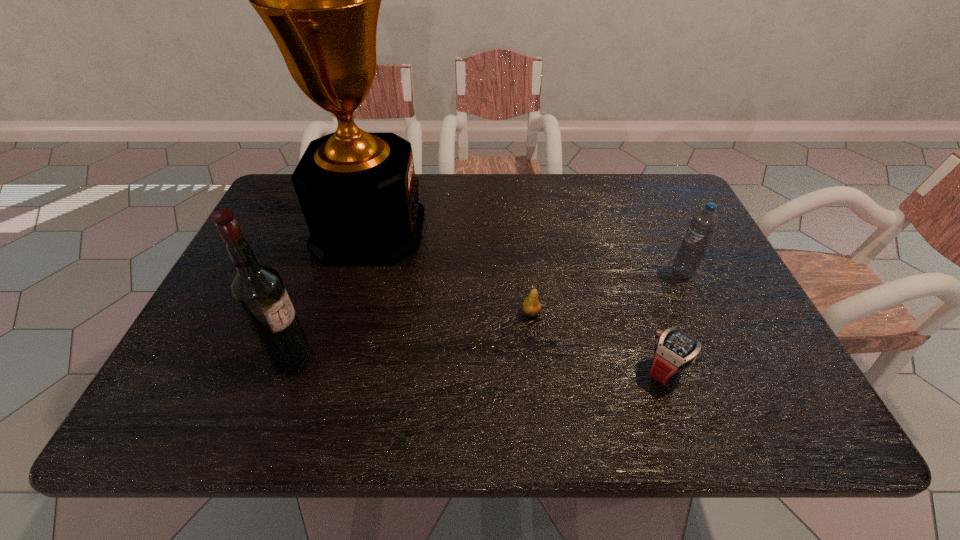
Find the location of a particular element. This screenshot has height=540, width=960. free space between the wine bottle and the trophy cup is located at coordinates (331, 295).

Point out which object is positioned as the fourth nearest to the pear. Please provide its 2D coordinates. Your answer should be formatted as a tuple, i.e. [(x, y)], where the tuple contains the x and y coordinates of a point satisfying the conditions above.

[(258, 290)]

Where is `the third closest object to the second tallest object`? the third closest object to the second tallest object is located at coordinates (675, 350).

What are the coordinates of `free location that satisfies the following two spatial constraints: 1. on the back side of the water bottle; 2. on the front of the trophy cup with the label` in the screenshot? It's located at (663, 230).

Where is `free space that satisfies the following two spatial constraints: 1. on the front of the rightmost object with the label; 2. on the right side of the tallest object`? The image size is (960, 540). free space that satisfies the following two spatial constraints: 1. on the front of the rightmost object with the label; 2. on the right side of the tallest object is located at coordinates (358, 272).

The height and width of the screenshot is (540, 960). What are the coordinates of `vacant space that satisfies the following two spatial constraints: 1. on the front and back of the watch; 2. on the left side of the fourth shortest object` in the screenshot? It's located at (290, 370).

At what (x,y) coordinates should I click in order to perform the action: click on vacant region that satisfies the following two spatial constraints: 1. on the front of the trophy cup with the label; 2. on the back side of the third shortest object. Please return your answer as a coordinate pair (x, y). Looking at the image, I should click on (358, 272).

The height and width of the screenshot is (540, 960). Find the location of `vacant region that satisfies the following two spatial constraints: 1. on the back side of the watch; 2. on the front of the trophy cup with the label`. vacant region that satisfies the following two spatial constraints: 1. on the back side of the watch; 2. on the front of the trophy cup with the label is located at coordinates (617, 230).

Locate an element on the screen. Image resolution: width=960 pixels, height=540 pixels. free space that satisfies the following two spatial constraints: 1. on the back side of the rightmost object; 2. on the front of the tallest object with the label is located at coordinates (663, 230).

The image size is (960, 540). In order to click on vacant area that satisfies the following two spatial constraints: 1. on the back side of the rightmost object; 2. on the left side of the third object from right to left in this screenshot , I will do `click(527, 272)`.